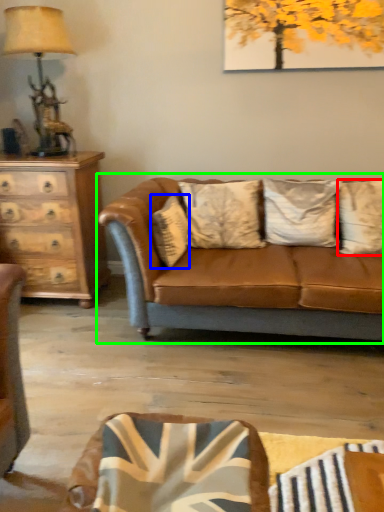
Question: Based on their relative distances, which object is farther from pillow (highlighted by a red box)? Choose from pillow (highlighted by a blue box) and studio couch (highlighted by a green box).

Choices:
 (A) pillow
 (B) studio couch

Answer: (A)